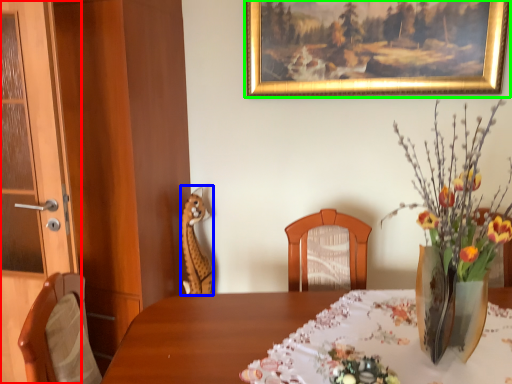
Question: Estimate the real-world distances between objects in this image. Which object is farther from door (highlighted by a red box), animal (highlighted by a blue box) or picture frame (highlighted by a green box)?

Choices:
 (A) animal
 (B) picture frame

Answer: (B)